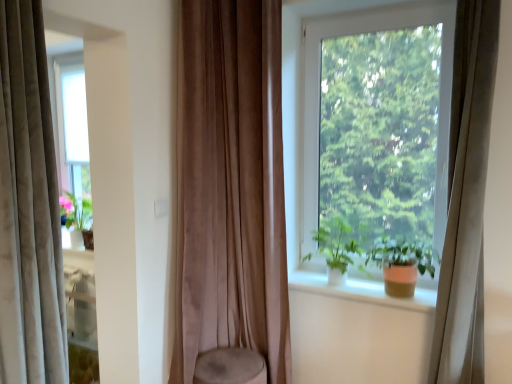
I want to click on vacant space underneath green matte plant at window (from a real-world perspective), so click(x=332, y=285).